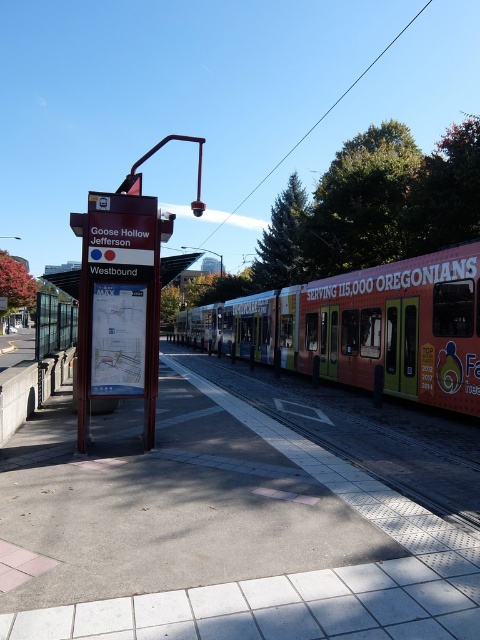
You are a delivery robot with a 1.2 meter wide package. You need to navigate through the gray concrete pavement at center and the metallic signboard at center. Which path allows your package to pass through without touching either object?

The gray concrete pavement at center is wider than the metallic signboard at center. Since your package is 1.2 meters wide, you should choose the gray concrete pavement at center as it can accommodate the width of your package.

You are a passenger at the Goose Hollow Jefferson MAX Westbound station. You see two points marked on the platform. One is at coordinate point (417,298) and the other is at point (284,408). From your perspective facing the train, which point is further back on the platform?

Point (417,298) is behind point (284,408), so the point at (417,298) is further back on the platform.